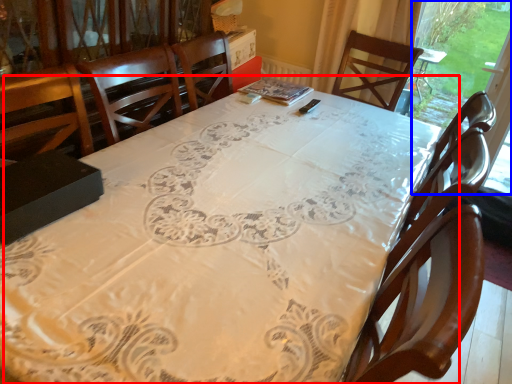
Question: Which object is closer to the camera taking this photo, table (highlighted by a red box) or window screen (highlighted by a blue box)?

Choices:
 (A) table
 (B) window screen

Answer: (A)